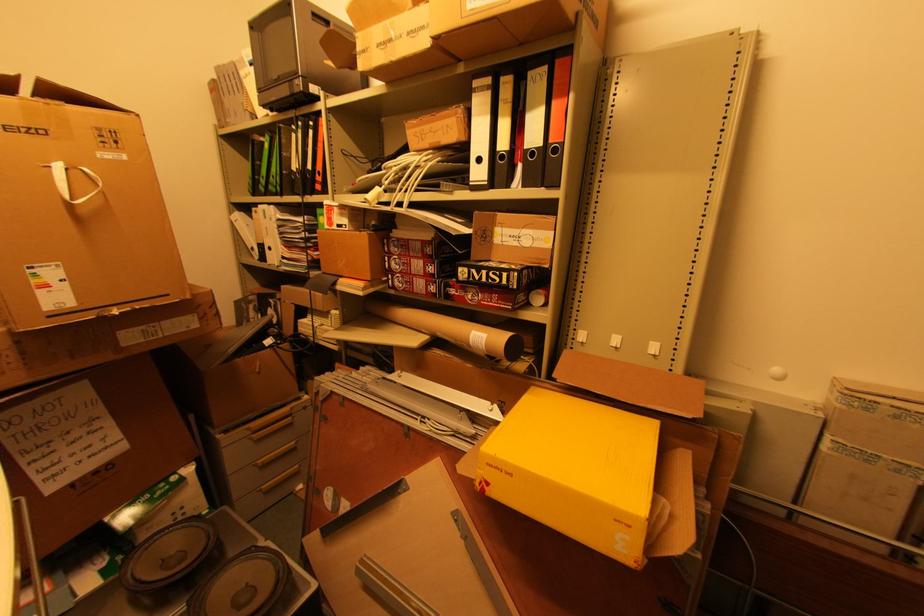
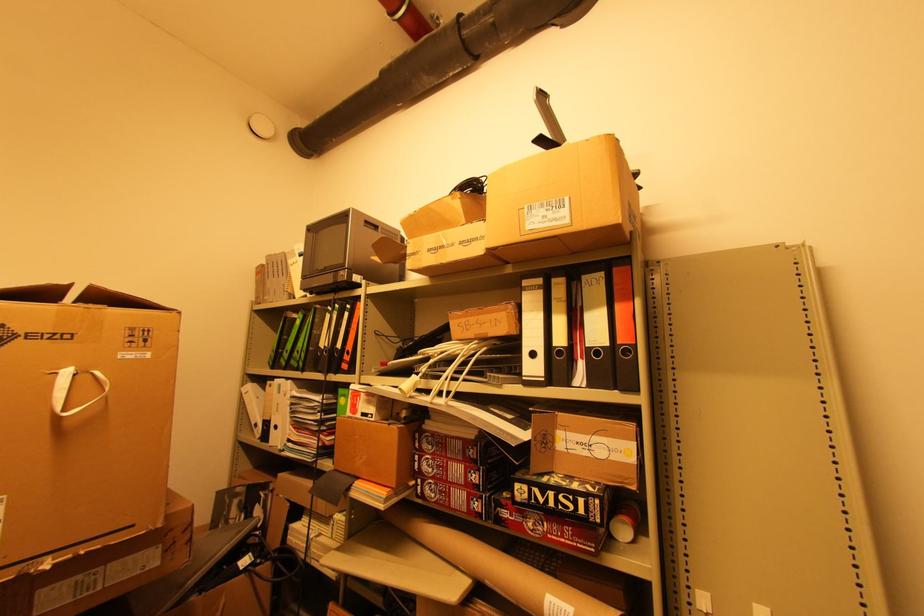
The point at (496,274) is marked in the first image. Where is the corresponding point in the second image?

(568, 498)